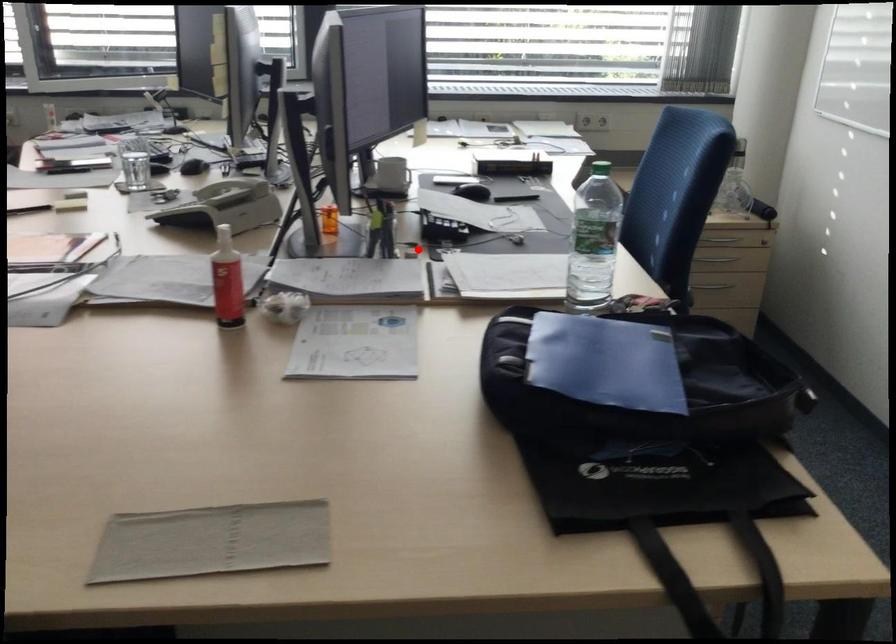
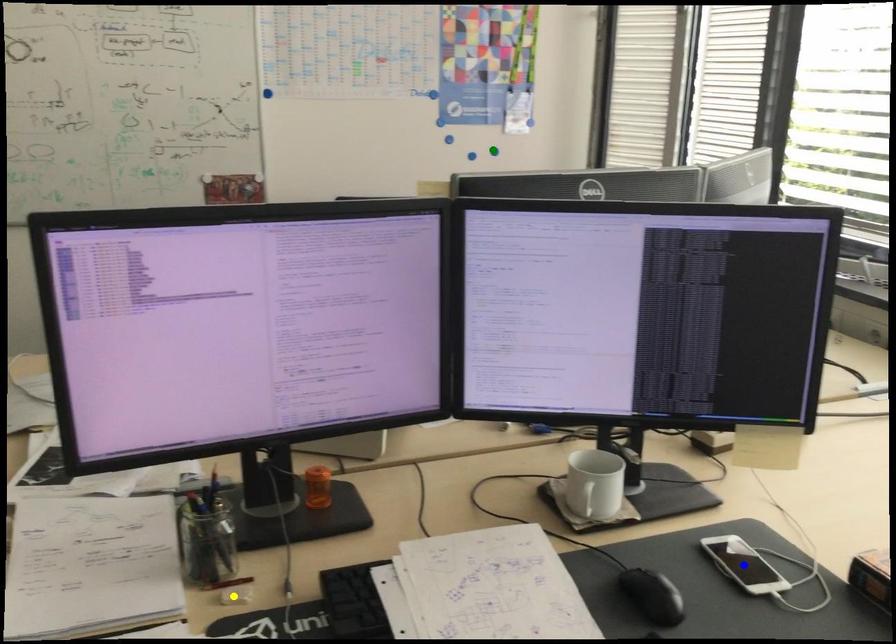
Question: I am providing you with two images of the same scene from different viewpoints. A red point is marked on the first image. You are given multiple points on the second image. Which point in image 2 represents the same 3d spot as the red point in image 1?

Choices:
 (A) yellow point
 (B) blue point
 (C) green point

Answer: (A)